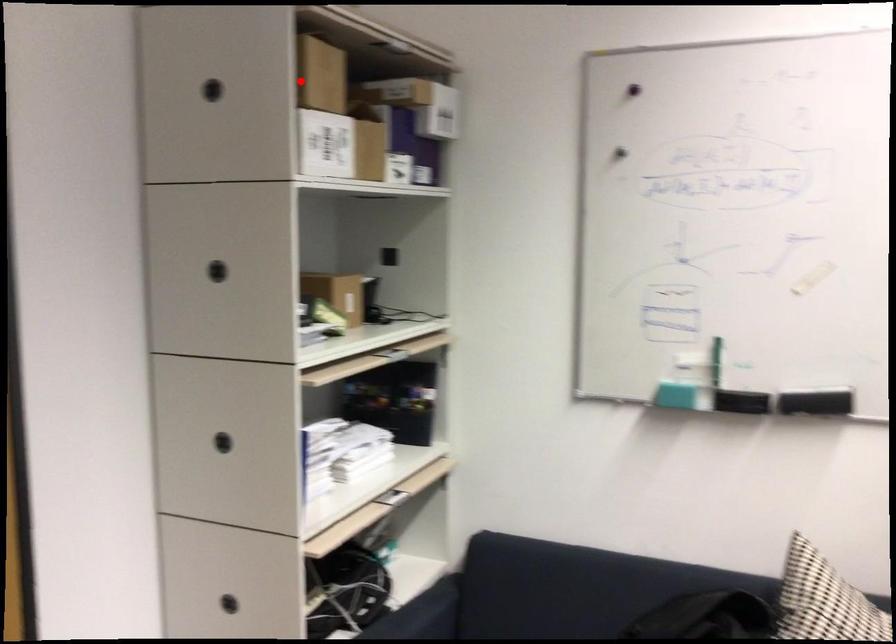
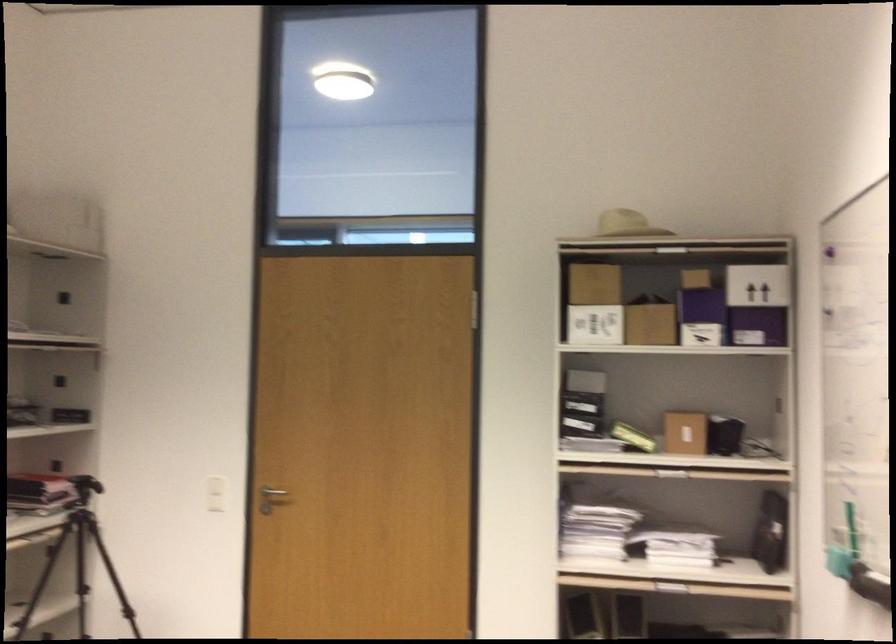
Question: I am providing you with two images of the same scene from different viewpoints. Image1 has a red point marked. In image2, the corresponding 3D location appears at what relative position? Reply with the corresponding letter.

Choices:
 (A) Closer
 (B) Farther

Answer: (B)